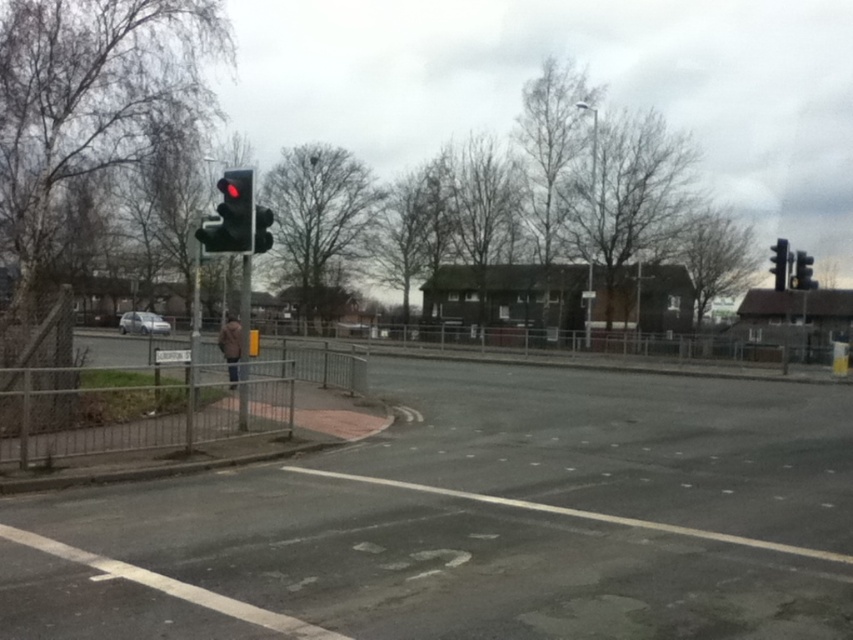
Question: Can you confirm if matte black traffic light at upper left is positioned to the left of metallic pole at left?

Choices:
 (A) no
 (B) yes

Answer: (A)

Question: Which of the following is the closest to the observer?

Choices:
 (A) silver metallic car at lower left
 (B) black glass traffic light at upper left

Answer: (B)

Question: Is black glass traffic light at upper left further to the viewer compared to metallic traffic light at right?

Choices:
 (A) yes
 (B) no

Answer: (B)

Question: Considering the real-world distances, which object is farthest from the white plastic street sign at upper center?

Choices:
 (A) metallic traffic light at right
 (B) yellow matte traffic light at right
 (C) silver metallic car at lower left
 (D) black glass traffic light at upper left

Answer: (C)

Question: Is metallic pole at left bigger than metallic traffic light at right?

Choices:
 (A) yes
 (B) no

Answer: (B)

Question: Which point appears closest to the camera in this image?

Choices:
 (A) (148, 323)
 (B) (804, 262)
 (C) (263, 246)
 (D) (167, 362)

Answer: (C)